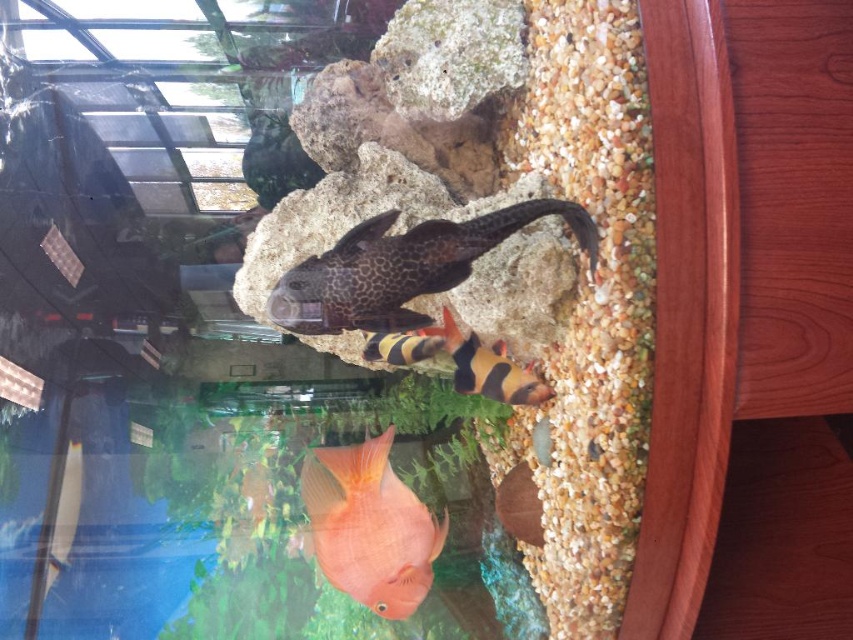
Question: Can you confirm if leopard print rock at center is positioned below black and orange striped fish at center?

Choices:
 (A) yes
 (B) no

Answer: (B)

Question: Is leopard print rock at center wider than black and orange striped fish at center?

Choices:
 (A) yes
 (B) no

Answer: (A)

Question: Estimate the real-world distances between objects in this image. Which object is farther from the black and orange striped fish at center?

Choices:
 (A) leopard print rock at center
 (B) orange matte goldfish at center

Answer: (B)

Question: Among these objects, which one is farthest from the camera?

Choices:
 (A) orange matte goldfish at center
 (B) leopard print rock at center
 (C) black and orange striped fish at center

Answer: (C)

Question: Can you confirm if leopard print rock at center is thinner than orange matte goldfish at center?

Choices:
 (A) yes
 (B) no

Answer: (B)

Question: Which point appears farthest from the camera in this image?

Choices:
 (A) (354, 589)
 (B) (506, 394)

Answer: (B)